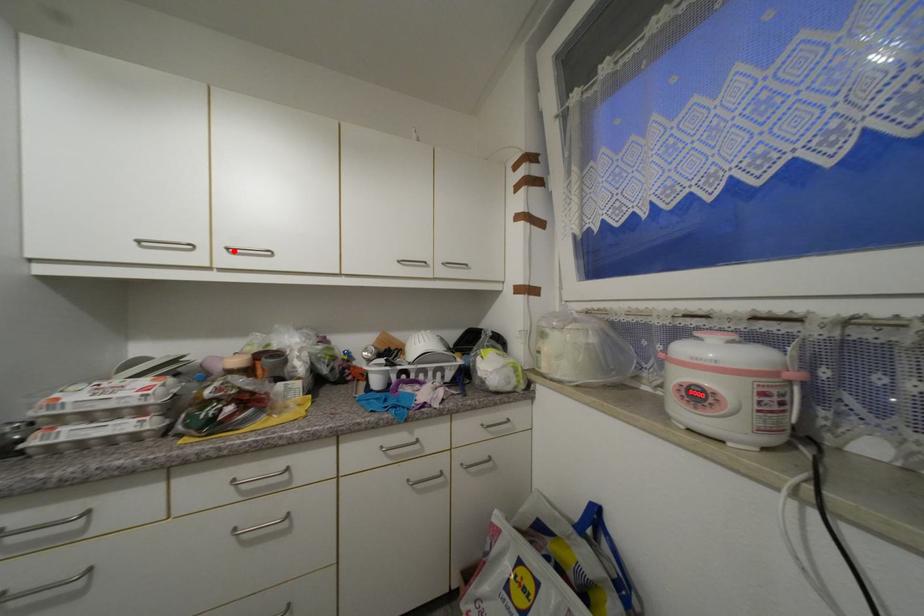
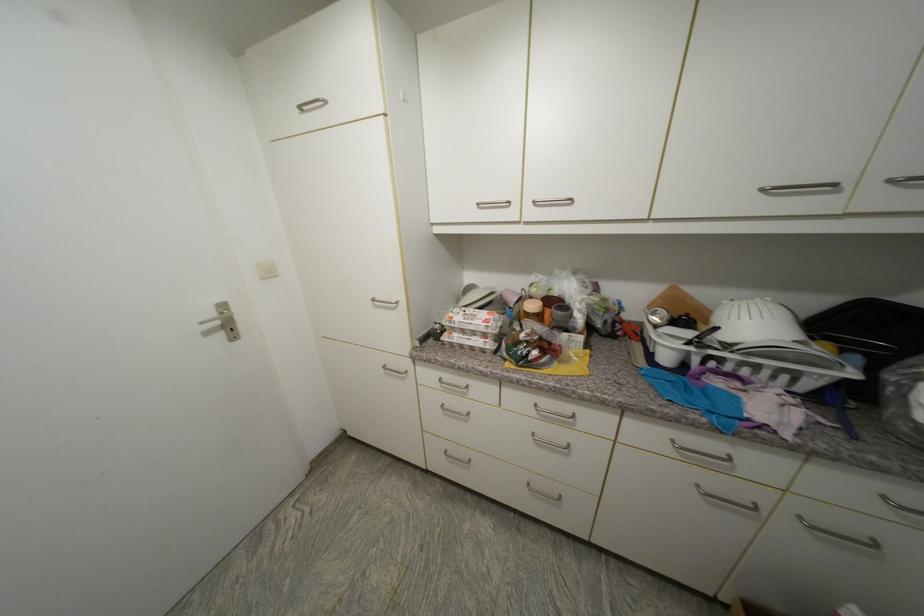
Find the pixel in the second image that matches the highlighted location in the first image.

(540, 204)